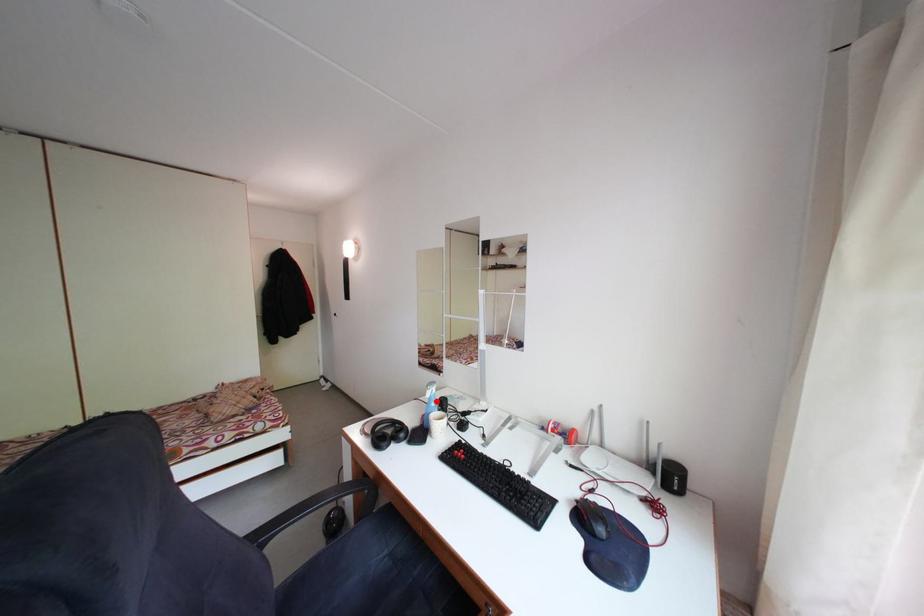
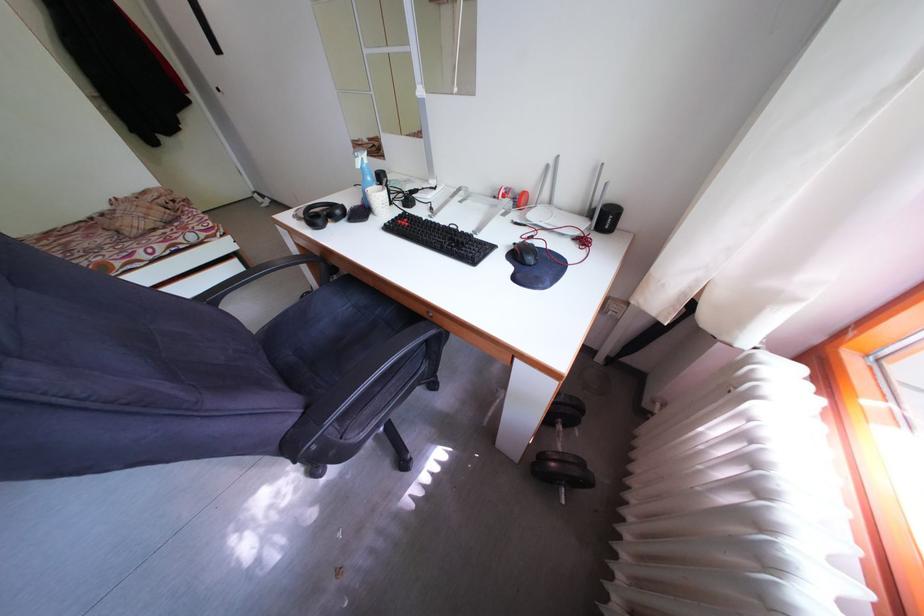
The point at the highlighted location is marked in the first image. Where is the corresponding point in the second image?

(367, 171)